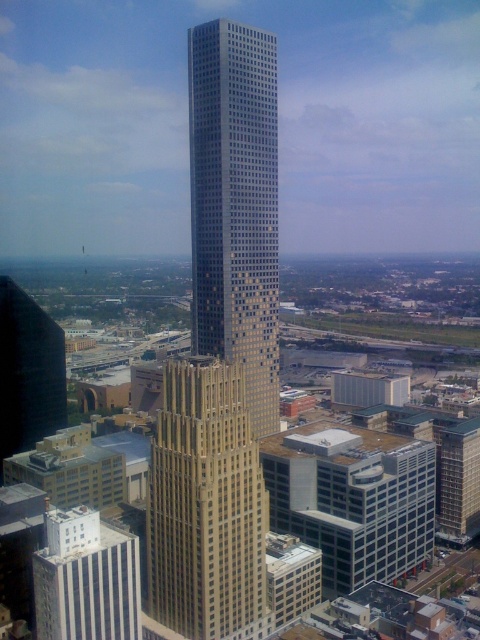
How much distance is there between smooth glass skyscraper at center and beige stone skyscraper at center?

smooth glass skyscraper at center and beige stone skyscraper at center are 141.77 feet apart from each other.

Who is more distant from viewer, (x=273, y=280) or (x=188, y=481)?

The point (x=273, y=280) is more distant.

This screenshot has width=480, height=640. What do you see at coordinates (236, 205) in the screenshot? I see `smooth glass skyscraper at center` at bounding box center [236, 205].

Find the location of a particular element. The image size is (480, 640). smooth glass skyscraper at center is located at coordinates (236, 205).

Is beige stone skyscraper at center to the left of white concrete building at lower left from the viewer's perspective?

No, beige stone skyscraper at center is not to the left of white concrete building at lower left.

Is beige stone skyscraper at center shorter than white concrete building at lower left?

No.

Between point (192, 428) and point (87, 573), which one is positioned in front?

Positioned in front is point (87, 573).

I want to click on beige stone skyscraper at center, so click(x=205, y=506).

Which is more to the right, smooth glass skyscraper at center or white concrete building at lower left?

smooth glass skyscraper at center is more to the right.

Can you confirm if smooth glass skyscraper at center is smaller than white concrete building at lower left?

Incorrect, smooth glass skyscraper at center is not smaller in size than white concrete building at lower left.

Does point (261, 54) lie behind point (76, 548)?

That is True.

This screenshot has height=640, width=480. I want to click on smooth glass skyscraper at center, so click(236, 205).